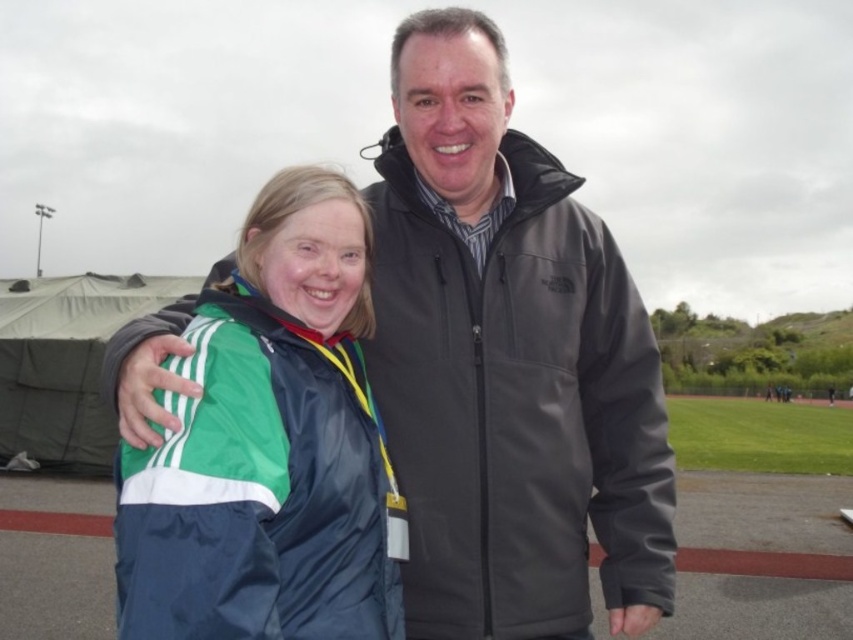
Question: Which point appears farthest from the camera in this image?

Choices:
 (A) (228, 566)
 (B) (463, 493)
 (C) (61, 451)

Answer: (C)

Question: Considering the real-world distances, which object is farthest from the green fabric jacket at center?

Choices:
 (A) dark gray softshell jacket at center
 (B) green fabric tent at left

Answer: (B)

Question: Is dark gray softshell jacket at center smaller than green fabric jacket at center?

Choices:
 (A) yes
 (B) no

Answer: (B)

Question: Considering the relative positions of dark gray softshell jacket at center and green fabric jacket at center in the image provided, where is dark gray softshell jacket at center located with respect to green fabric jacket at center?

Choices:
 (A) right
 (B) left

Answer: (A)

Question: Estimate the real-world distances between objects in this image. Which object is closer to the green fabric jacket at center?

Choices:
 (A) dark gray softshell jacket at center
 (B) green fabric tent at left

Answer: (A)

Question: Is dark gray softshell jacket at center bigger than green fabric tent at left?

Choices:
 (A) no
 (B) yes

Answer: (B)